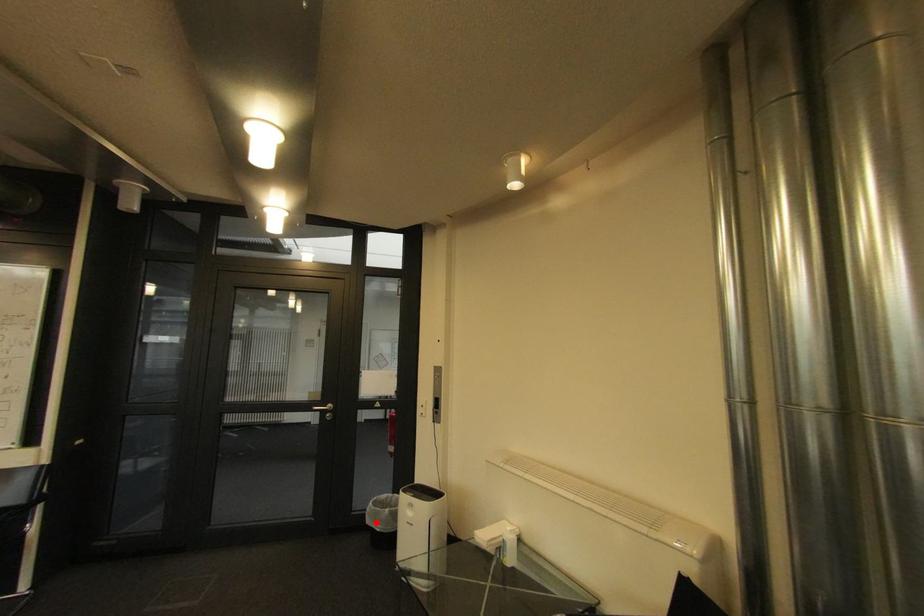
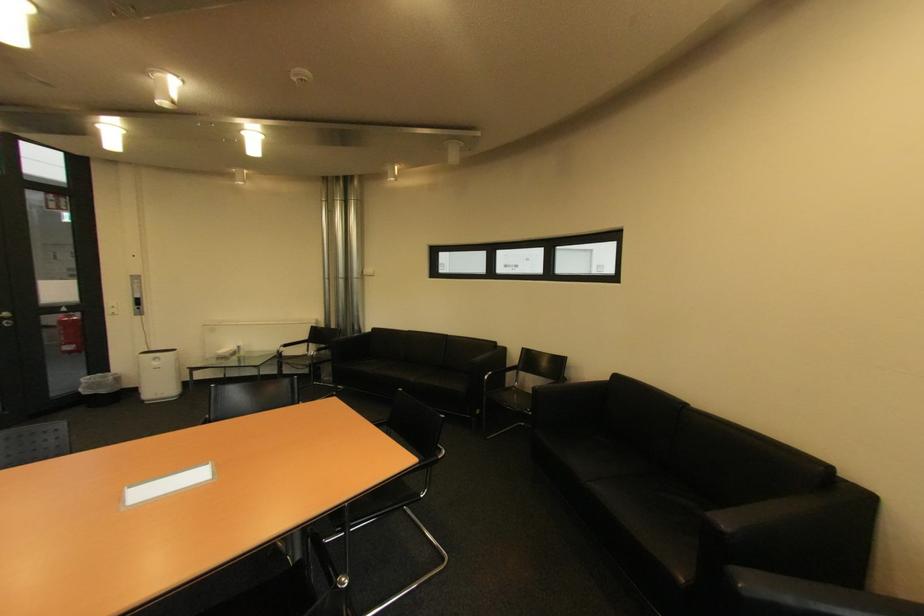
In the second image, find the point that corresponds to the highlighted location in the first image.

(94, 394)